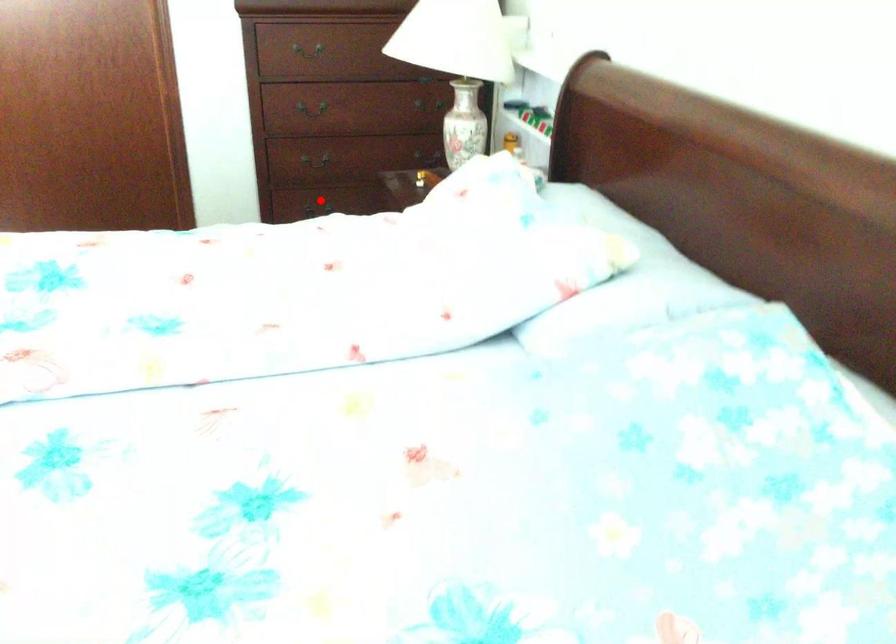
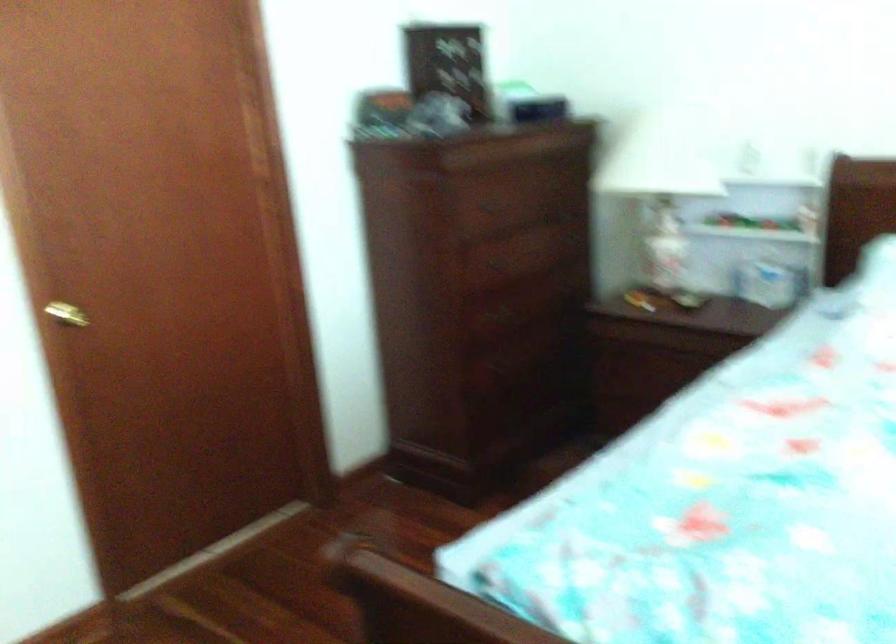
Question: I am providing you with two images of the same scene from different viewpoints. A red point is marked on the first image. At the location where the point appears in image 1, is it still visible in image 2?

Choices:
 (A) Yes
 (B) No

Answer: (B)